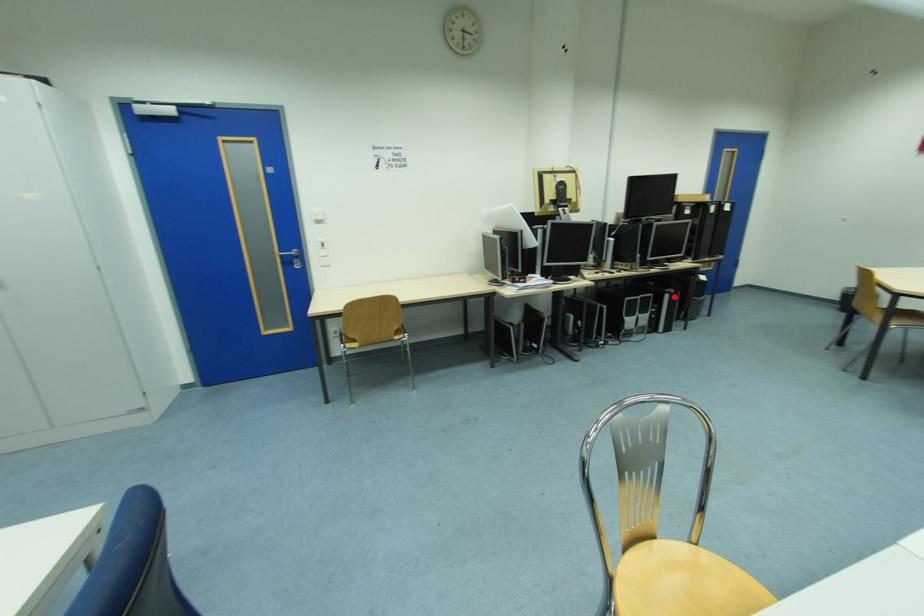
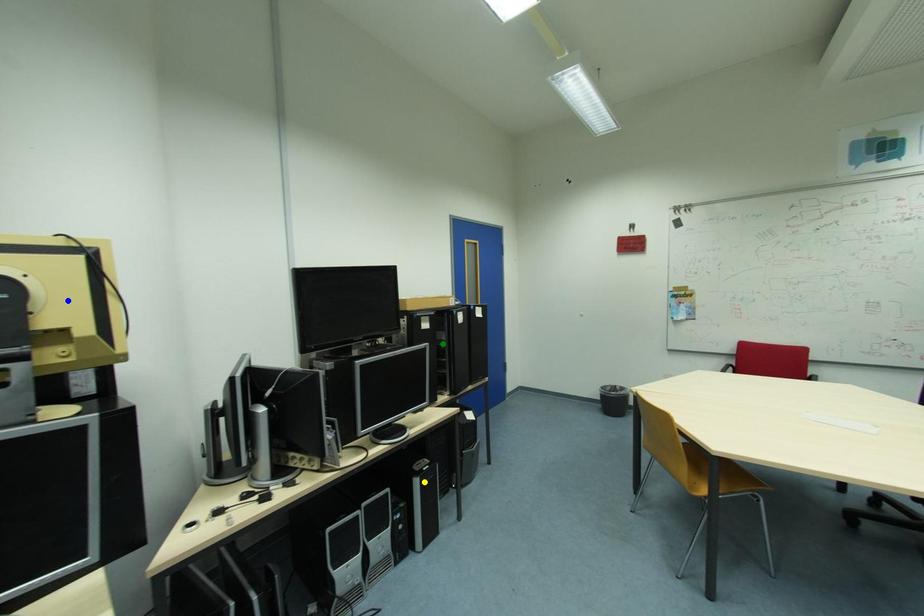
Question: I am providing you with two images of the same scene from different viewpoints. A red point is marked on the first image. You are given multiple points on the second image. Which mark in image 2 goes with the point in image 1?

Choices:
 (A) blue point
 (B) yellow point
 (C) green point

Answer: (B)